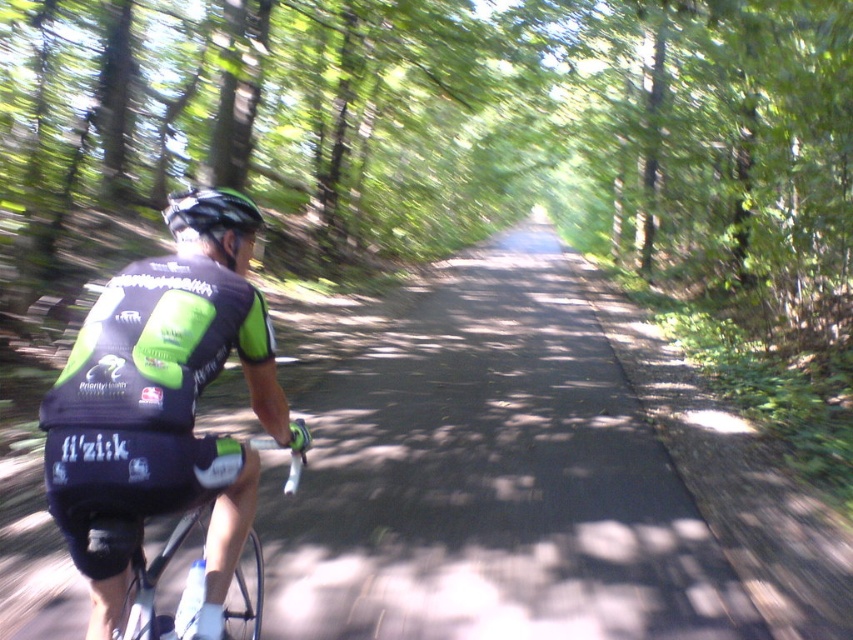
You are a photographer standing at the point indicated by point (151, 577). You want to take a photo of the cyclist wearing a black cycling jersey with green accents and the brand fizik on the back. Where should you position yourself relative to the point to capture the cyclist in the frame?

The point (151, 577) indicates the location of the black matte cycling jersey at left. To capture the cyclist in the frame, you should position yourself to the right of the point since the jersey is located at the left side of the scene.

You are a photographer positioned behind the cyclist. You want to capture a shot where both the black matte cycling jersey at left and the matte black helmet at center are in focus. Given that your camera can only focus on objects within a 5 feet range, will you be able to achieve this?

The black matte cycling jersey at left is 5.40 feet from the matte black helmet at center. Since the distance between them exceeds the camera focus range of 5 feet, you cannot have both in focus simultaneously.